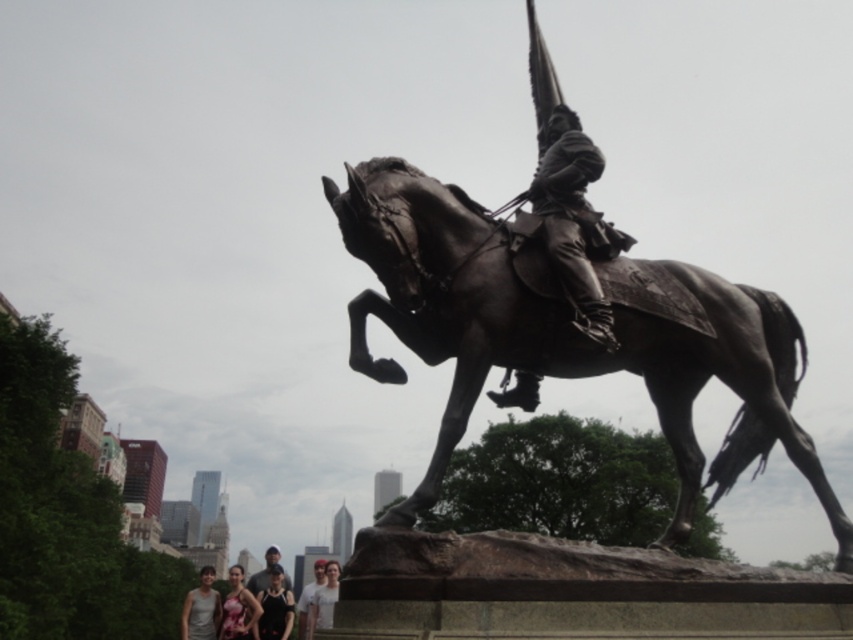
Question: Estimate the real-world distances between objects in this image. Which object is farther from the matte pink dress at lower center?

Choices:
 (A) white matte shirt at lower center
 (B) dark gray fabric jacket at lower center

Answer: (A)

Question: Which object is farther from the camera taking this photo?

Choices:
 (A) matte pink dress at lower center
 (B) white matte shirt at lower center

Answer: (A)

Question: Can you confirm if dark gray fabric jacket at lower center is bigger than white matte shirt at lower center?

Choices:
 (A) no
 (B) yes

Answer: (A)

Question: Which of the following is the farthest from the observer?

Choices:
 (A) white matte t-shirt at lower center
 (B) matte pink dress at lower center

Answer: (B)

Question: Does dark gray fabric jacket at lower center appear on the right side of matte black shirt at lower center?

Choices:
 (A) yes
 (B) no

Answer: (A)

Question: Is the position of bronze statue at center more distant than that of matte gray tank top at lower left?

Choices:
 (A) no
 (B) yes

Answer: (A)